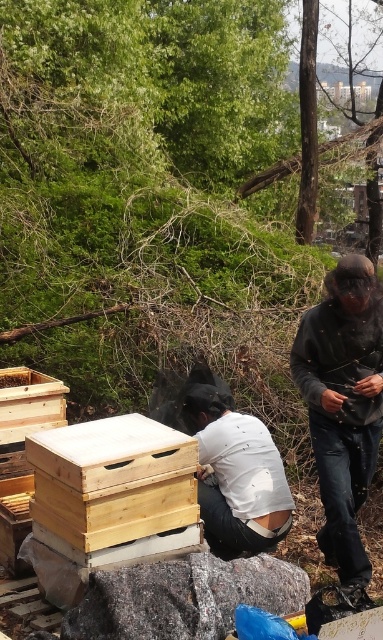
Question: Based on their relative distances, which object is farther from the dark gray fleece jacket at right?

Choices:
 (A) light brown wooden beehive at center
 (B) white matte shirt at center

Answer: (A)

Question: Among these objects, which one is nearest to the camera?

Choices:
 (A) white matte shirt at center
 (B) dark gray fleece jacket at right
 (C) light brown wooden beehive at center

Answer: (C)

Question: Does light brown wooden beehive at center appear on the right side of white matte shirt at center?

Choices:
 (A) yes
 (B) no

Answer: (B)

Question: Among these points, which one is farthest from the camera?

Choices:
 (A) (322, 314)
 (B) (94, 481)
 (C) (278, 499)

Answer: (C)

Question: Does dark gray fleece jacket at right have a greater width compared to white matte shirt at center?

Choices:
 (A) no
 (B) yes

Answer: (A)

Question: Observing the image, what is the correct spatial positioning of dark gray fleece jacket at right in reference to light brown wooden beehive at center?

Choices:
 (A) above
 (B) below

Answer: (A)